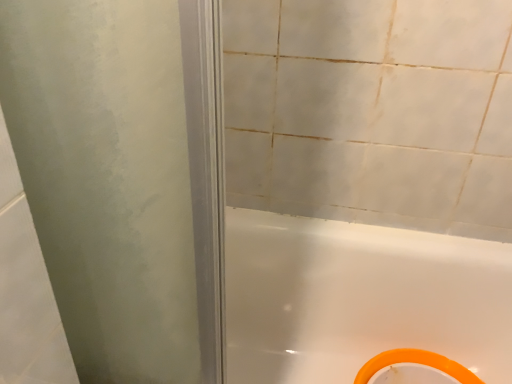
Where is `white glossy bathtub at lower right`? The height and width of the screenshot is (384, 512). white glossy bathtub at lower right is located at coordinates 359,298.

Image resolution: width=512 pixels, height=384 pixels. Describe the element at coordinates (359, 298) in the screenshot. I see `white glossy bathtub at lower right` at that location.

Find the location of `orange rubber ring at bottom right`. orange rubber ring at bottom right is located at coordinates (415, 366).

This screenshot has height=384, width=512. What do you see at coordinates (415, 366) in the screenshot? I see `orange rubber ring at bottom right` at bounding box center [415, 366].

Identify the location of white glossy bathtub at lower right. The height and width of the screenshot is (384, 512). (359, 298).

Is white glossy bathtub at lower right to the right of orange rubber ring at bottom right from the viewer's perspective?

No.

Between white glossy bathtub at lower right and orange rubber ring at bottom right, which one is positioned behind?

orange rubber ring at bottom right is further away from the camera.

Considering the positions of points (359, 298) and (362, 367), is point (359, 298) closer to camera compared to point (362, 367)?

No, it is behind (362, 367).

From the image's perspective, relative to orange rubber ring at bottom right, is white glossy bathtub at lower right above or below?

Based on their image positions, white glossy bathtub at lower right is located above orange rubber ring at bottom right.

From a real-world perspective, which is physically above, white glossy bathtub at lower right or orange rubber ring at bottom right?

In real-world perspective, white glossy bathtub at lower right is above.

In the scene shown: Considering the relative sizes of white glossy bathtub at lower right and orange rubber ring at bottom right in the image provided, is white glossy bathtub at lower right thinner than orange rubber ring at bottom right?

No.

Considering the sizes of white glossy bathtub at lower right and orange rubber ring at bottom right in the image, is white glossy bathtub at lower right taller or shorter than orange rubber ring at bottom right?

Clearly, white glossy bathtub at lower right is taller compared to orange rubber ring at bottom right.

Who is smaller, white glossy bathtub at lower right or orange rubber ring at bottom right?

Smaller between the two is orange rubber ring at bottom right.

Is white glossy bathtub at lower right not inside orange rubber ring at bottom right?

white glossy bathtub at lower right lies outside orange rubber ring at bottom right's area.

Is white glossy bathtub at lower right with orange rubber ring at bottom right?

There is a gap between white glossy bathtub at lower right and orange rubber ring at bottom right.

Is white glossy bathtub at lower right turned away from orange rubber ring at bottom right?

Yes.

How many degrees apart are the facing directions of white glossy bathtub at lower right and orange rubber ring at bottom right?

0.00058 degrees.

How distant is white glossy bathtub at lower right from orange rubber ring at bottom right?

white glossy bathtub at lower right and orange rubber ring at bottom right are 21.87 centimeters apart.

Find the location of `bidet on the right side of white glossy bathtub at lower right`. bidet on the right side of white glossy bathtub at lower right is located at coordinates click(415, 366).

Which object is positioned more to the right, orange rubber ring at bottom right or white glossy bathtub at lower right?

From the viewer's perspective, orange rubber ring at bottom right appears more on the right side.

Considering the positions of objects orange rubber ring at bottom right and white glossy bathtub at lower right in the image provided, who is in front, orange rubber ring at bottom right or white glossy bathtub at lower right?

Positioned in front is white glossy bathtub at lower right.

Is point (457, 376) closer or farther from the camera than point (304, 316)?

Clearly, point (457, 376) is closer to the camera than point (304, 316).

From the image's perspective, which is above, orange rubber ring at bottom right or white glossy bathtub at lower right?

white glossy bathtub at lower right, from the image's perspective.

From a real-world perspective, is orange rubber ring at bottom right on white glossy bathtub at lower right?

No, from a real-world perspective, orange rubber ring at bottom right is not over white glossy bathtub at lower right

Which of these two, orange rubber ring at bottom right or white glossy bathtub at lower right, is thinner?

orange rubber ring at bottom right is thinner.

In terms of height, does orange rubber ring at bottom right look taller or shorter compared to white glossy bathtub at lower right?

Considering their sizes, orange rubber ring at bottom right has less height than white glossy bathtub at lower right.

Between orange rubber ring at bottom right and white glossy bathtub at lower right, which one has smaller size?

orange rubber ring at bottom right.

Can we say orange rubber ring at bottom right lies outside white glossy bathtub at lower right?

No, orange rubber ring at bottom right is not outside of white glossy bathtub at lower right.

Is orange rubber ring at bottom right with white glossy bathtub at lower right?

orange rubber ring at bottom right and white glossy bathtub at lower right are clearly separated.

Is orange rubber ring at bottom right turned away from white glossy bathtub at lower right?

That's right, orange rubber ring at bottom right is facing away from white glossy bathtub at lower right.

Measure the distance between orange rubber ring at bottom right and white glossy bathtub at lower right.

8.61 inches.

Where is `bidet on the right side of white glossy bathtub at lower right`? This screenshot has height=384, width=512. bidet on the right side of white glossy bathtub at lower right is located at coordinates (415, 366).

Find the location of a particular element. Image resolution: width=512 pixels, height=384 pixels. bathtub to the left of orange rubber ring at bottom right is located at coordinates (359, 298).

You are a GUI agent. You are given a task and a screenshot of the screen. Output one action in this format:
    pyautogui.click(x=<x>, y=<y>)
    Task: Click on the bathtub that appears above the orange rubber ring at bottom right (from the image's perspective)
    This screenshot has height=384, width=512.
    Given the screenshot: What is the action you would take?
    pyautogui.click(x=359, y=298)